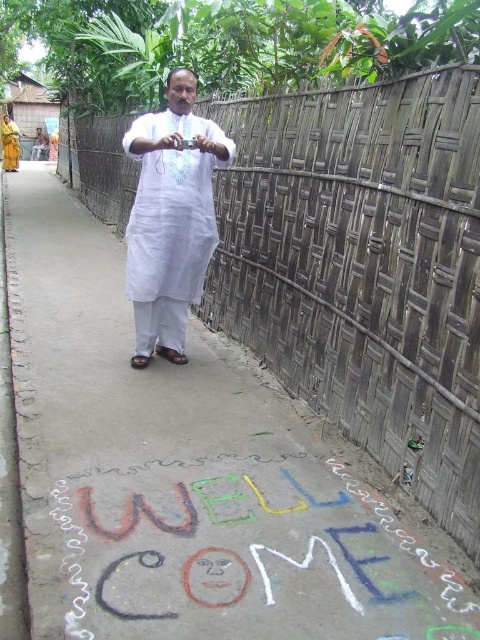
Is point (405, 269) farther from viewer compared to point (208, 476)?

No, (405, 269) is closer to viewer.

Does wooden at center appear under chalky multicolored welcome sign at center?

No.

I want to click on wooden at center, so click(x=363, y=268).

Who is taller, chalky multicolored welcome sign at center or yellow fabric robe at left?

With more height is yellow fabric robe at left.

Can you confirm if chalky multicolored welcome sign at center is thinner than yellow fabric robe at left?

In fact, chalky multicolored welcome sign at center might be wider than yellow fabric robe at left.

Where is `chalky multicolored welcome sign at center`? Image resolution: width=480 pixels, height=640 pixels. chalky multicolored welcome sign at center is located at coordinates (251, 556).

You are a GUI agent. You are given a task and a screenshot of the screen. Output one action in this format:
    pyautogui.click(x=<x>, y=<y>)
    Task: Click on the chalky multicolored welcome sign at center
    
    Given the screenshot: What is the action you would take?
    pyautogui.click(x=251, y=556)

Can you confirm if wooden at center is taller than yellow fabric robe at left?

Yes, wooden at center is taller than yellow fabric robe at left.

Between point (312, 380) and point (14, 168), which one is positioned in front?

Point (312, 380)

The width and height of the screenshot is (480, 640). I want to click on wooden at center, so click(x=363, y=268).